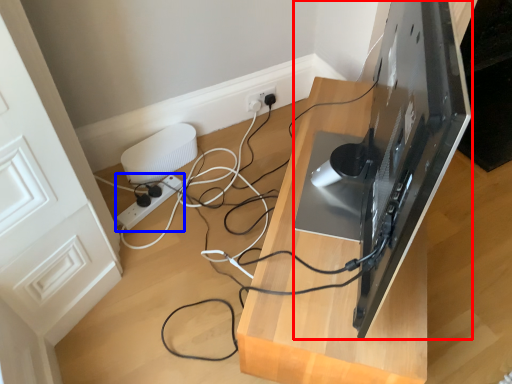
Question: Among these objects, which one is farthest to the camera, desktop computer (highlighted by a red box) or extension cord (highlighted by a blue box)?

Choices:
 (A) desktop computer
 (B) extension cord

Answer: (B)